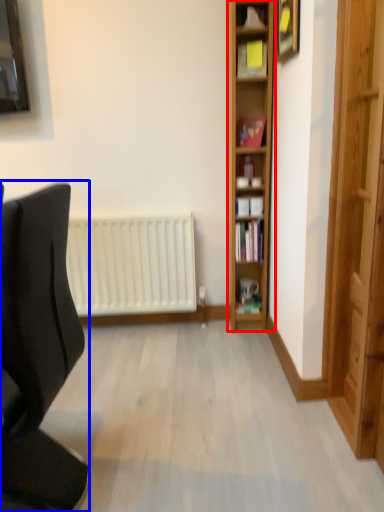
Question: Which of the following is the farthest to the observer, shelf (highlighted by a red box) or chair (highlighted by a blue box)?

Choices:
 (A) shelf
 (B) chair

Answer: (A)